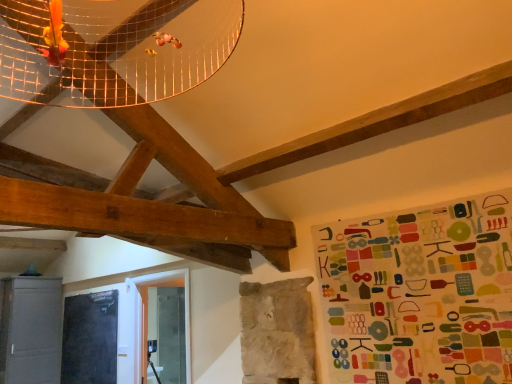
Question: In the image, is black matte bulletin board at lower left on the left side or the right side of matte gray cabinet at lower left?

Choices:
 (A) right
 (B) left

Answer: (A)

Question: In terms of height, does black matte bulletin board at lower left look taller or shorter compared to matte gray cabinet at lower left?

Choices:
 (A) tall
 (B) short

Answer: (B)

Question: Does point (105, 357) appear closer or farther from the camera than point (48, 377)?

Choices:
 (A) farther
 (B) closer

Answer: (A)

Question: Considering the positions of point (50, 365) and point (117, 314), is point (50, 365) closer or farther from the camera than point (117, 314)?

Choices:
 (A) farther
 (B) closer

Answer: (B)

Question: Considering the relative positions of matte gray cabinet at lower left and black matte bulletin board at lower left in the image provided, is matte gray cabinet at lower left to the left or to the right of black matte bulletin board at lower left?

Choices:
 (A) left
 (B) right

Answer: (A)

Question: Is matte gray cabinet at lower left wider or thinner than black matte bulletin board at lower left?

Choices:
 (A) wide
 (B) thin

Answer: (A)

Question: From a real-world perspective, is matte gray cabinet at lower left above or below black matte bulletin board at lower left?

Choices:
 (A) below
 (B) above

Answer: (B)